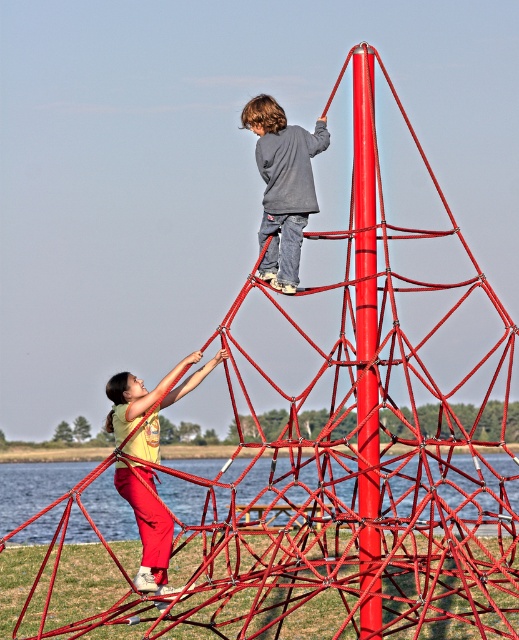
You are a photographer trying to capture the scene. You notice the glossy metal pole at upper center and the matte yellow shirt at center. Which object appears narrower in the image?

The glossy metal pole at upper center appears narrower than the matte yellow shirt at center because it has a lesser width.

You are a parent standing at the base of the red climbing structure. Your child wearing a gray cotton shirt at upper center is playing near the glossy metal pole at upper center. You want to hand them a water bottle. Can you reach them from where you are standing if your arm can extend 0.8 meters?

The distance between the glossy metal pole at upper center and the gray cotton shirt at upper center is 1.46 meters. Since your arm can only extend 0.8 meters, you cannot reach your child wearing the gray cotton shirt at upper center from your current position.

You are a parent observing the two children at the park. You notice the glossy metal pole at upper center and the gray cotton shirt at upper center. Which object is located to the right of the other?

The glossy metal pole at upper center is positioned on the right side of gray cotton shirt at upper center.